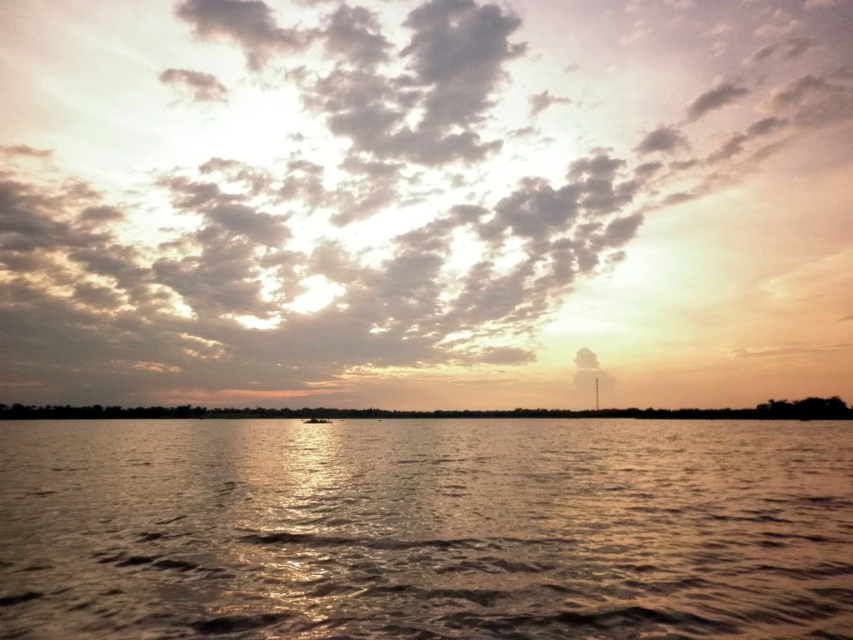
Can you confirm if sandy textured clouds at upper center is thinner than glistening water at center?

No, sandy textured clouds at upper center is not thinner than glistening water at center.

Is point (389, 374) positioned before point (387, 436)?

That is False.

The image size is (853, 640). Identify the location of sandy textured clouds at upper center. (425, 200).

Between brown matte land at lower center and smooth brown boat at center, which one appears on the left side from the viewer's perspective?

smooth brown boat at center is more to the left.

Between brown matte land at lower center and smooth brown boat at center, which one has less height?

Standing shorter between the two is brown matte land at lower center.

Is point (54, 413) positioned behind point (328, 420)?

Yes.

Identify the location of brown matte land at lower center. (434, 412).

Can you confirm if glistening water at center is positioned to the right of brown matte land at lower center?

No, glistening water at center is not to the right of brown matte land at lower center.

Is point (207, 627) behind point (105, 416)?

No.

This screenshot has width=853, height=640. What are the coordinates of `glistening water at center` in the screenshot? It's located at (425, 529).